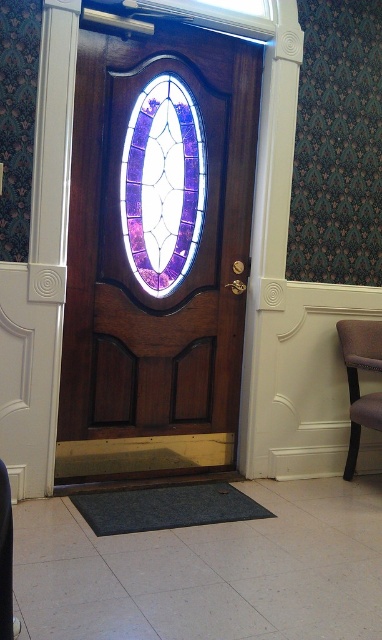
Question: Does purple stained glass at center have a smaller size compared to velvet brown chair at right?

Choices:
 (A) yes
 (B) no

Answer: (B)

Question: Where is purple stained glass at center located in relation to velvet brown chair at right in the image?

Choices:
 (A) below
 (B) above

Answer: (B)

Question: Which is nearer to the polished wood door at center?

Choices:
 (A) purple stained glass at center
 (B) velvet brown chair at right

Answer: (A)

Question: Which object is closer to the camera taking this photo?

Choices:
 (A) velvet brown chair at right
 (B) purple stained glass at center

Answer: (B)

Question: Is polished wood door at center thinner than velvet brown chair at right?

Choices:
 (A) no
 (B) yes

Answer: (A)

Question: Which point appears farthest from the camera in this image?

Choices:
 (A) (351, 417)
 (B) (178, 291)

Answer: (A)